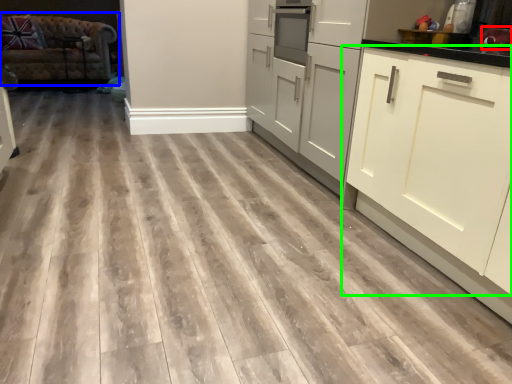
Question: Which is farther away from appliance (highlighted by a red box)? studio couch (highlighted by a blue box) or cabinetry (highlighted by a green box)?

Choices:
 (A) studio couch
 (B) cabinetry

Answer: (A)